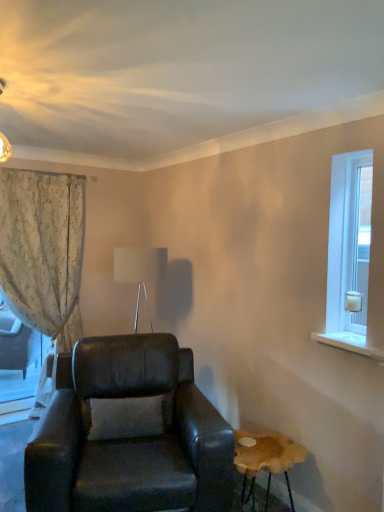
Question: Is white fabric lampshade at upper center oriented towards leather armchair at center?

Choices:
 (A) yes
 (B) no

Answer: (B)

Question: From a real-world perspective, is white fabric lampshade at upper center physically above leather armchair at center?

Choices:
 (A) yes
 (B) no

Answer: (A)

Question: From the image's perspective, does white fabric lampshade at upper center appear lower than leather armchair at center?

Choices:
 (A) yes
 (B) no

Answer: (B)

Question: Is white fabric lampshade at upper center positioned behind leather armchair at center?

Choices:
 (A) no
 (B) yes

Answer: (B)

Question: Can you confirm if white fabric lampshade at upper center is shorter than leather armchair at center?

Choices:
 (A) yes
 (B) no

Answer: (A)

Question: Considering the relative positions of white fabric lampshade at upper center and leather armchair at center in the image provided, is white fabric lampshade at upper center to the left of leather armchair at center from the viewer's perspective?

Choices:
 (A) no
 (B) yes

Answer: (B)

Question: From the image's perspective, is clear glass door at right on wooden stool at lower right?

Choices:
 (A) no
 (B) yes

Answer: (B)

Question: Does clear glass door at right appear on the right side of wooden stool at lower right?

Choices:
 (A) yes
 (B) no

Answer: (A)

Question: Could you tell me if clear glass door at right is turned towards wooden stool at lower right?

Choices:
 (A) no
 (B) yes

Answer: (A)

Question: Is clear glass door at right shorter than wooden stool at lower right?

Choices:
 (A) no
 (B) yes

Answer: (A)

Question: Does clear glass door at right come behind wooden stool at lower right?

Choices:
 (A) yes
 (B) no

Answer: (A)

Question: Is clear glass door at right located outside wooden stool at lower right?

Choices:
 (A) no
 (B) yes

Answer: (B)

Question: Considering the relative positions of wooden stool at lower right and leather armchair at center in the image provided, is wooden stool at lower right behind leather armchair at center?

Choices:
 (A) yes
 (B) no

Answer: (A)